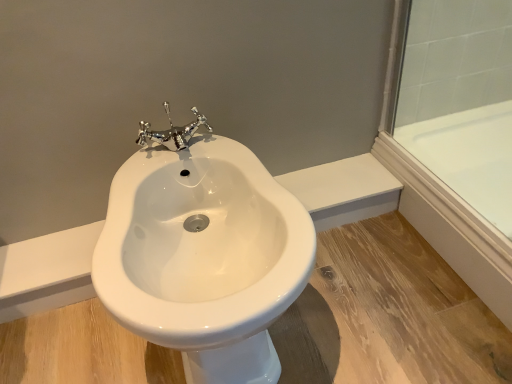
Where is `vacant space to the right of white glossy bidet at center`? This screenshot has height=384, width=512. vacant space to the right of white glossy bidet at center is located at coordinates (383, 300).